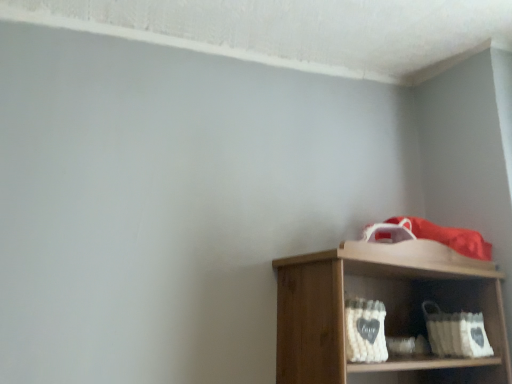
Question: Should I look upward or downward to see white woven basket at lower center, the first basket in the left-to-right sequence?

Choices:
 (A) down
 (B) up

Answer: (A)

Question: Can you confirm if white fabric basket at lower right, positioned as the first basket in back-to-front order, is smaller than white woven basket at lower center, the first basket positioned from the front?

Choices:
 (A) yes
 (B) no

Answer: (B)

Question: From the image's perspective, is white fabric basket at lower right, the 2th basket from the front, located beneath white woven basket at lower center, which is counted as the 2th basket, starting from the right?

Choices:
 (A) yes
 (B) no

Answer: (A)

Question: Does white fabric basket at lower right, which is the second basket in left-to-right order, have a lesser width compared to white woven basket at lower center, the first basket in the left-to-right sequence?

Choices:
 (A) yes
 (B) no

Answer: (B)

Question: From the image's perspective, is white fabric basket at lower right, positioned as the first basket in back-to-front order, on white woven basket at lower center, the first basket in the left-to-right sequence?

Choices:
 (A) no
 (B) yes

Answer: (A)

Question: Does white fabric basket at lower right, which is the second basket in left-to-right order, appear on the right side of white woven basket at lower center, the first basket positioned from the front?

Choices:
 (A) no
 (B) yes

Answer: (B)

Question: Does white fabric basket at lower right, placed as the 1th basket when sorted from right to left, contain white woven basket at lower center, which is counted as the 2th basket, starting from the right?

Choices:
 (A) yes
 (B) no

Answer: (B)

Question: Is white woven basket at lower center, the first basket in the left-to-right sequence, not inside white fabric basket at lower right, positioned as the first basket in back-to-front order?

Choices:
 (A) no
 (B) yes

Answer: (B)

Question: From a real-world perspective, is white woven basket at lower center, which is counted as the 2th basket, starting from the right, physically below white fabric basket at lower right, placed as the 1th basket when sorted from right to left?

Choices:
 (A) no
 (B) yes

Answer: (A)

Question: Is white woven basket at lower center, which is counted as the 2th basket, starting from the right, taller than white fabric basket at lower right, the 2th basket from the front?

Choices:
 (A) no
 (B) yes

Answer: (A)

Question: Is white woven basket at lower center, which is counted as the 2th basket, starting from the right, positioned before white fabric basket at lower right, the 2th basket from the front?

Choices:
 (A) yes
 (B) no

Answer: (A)

Question: From a real-world perspective, is white woven basket at lower center, the first basket in the left-to-right sequence, over white fabric basket at lower right, positioned as the first basket in back-to-front order?

Choices:
 (A) yes
 (B) no

Answer: (A)

Question: Is white woven basket at lower center, which is counted as the 2th basket, starting from the right, wider than white fabric basket at lower right, the 2th basket from the front?

Choices:
 (A) no
 (B) yes

Answer: (A)

Question: Visually, is white fabric basket at lower right, the 2th basket from the front, positioned to the left or to the right of white woven basket at lower center, the first basket positioned from the front?

Choices:
 (A) right
 (B) left

Answer: (A)